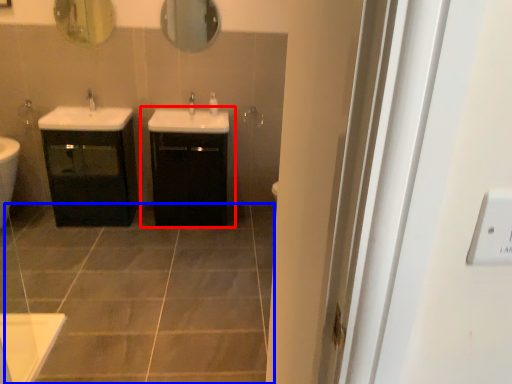
Question: Which point is closer to the camera, bathroom cabinet (highlighted by a red box) or ceramic tile (highlighted by a blue box)?

Choices:
 (A) bathroom cabinet
 (B) ceramic tile

Answer: (B)